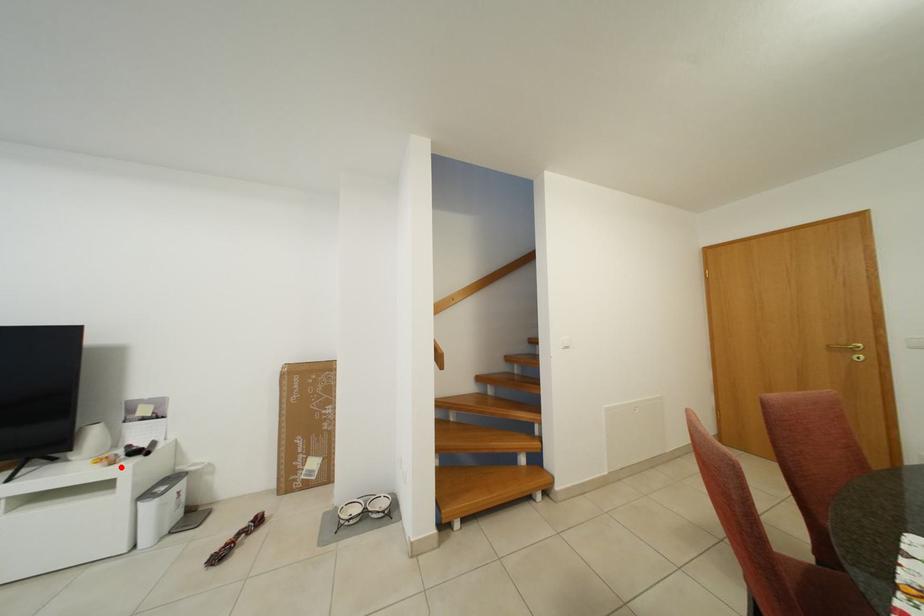
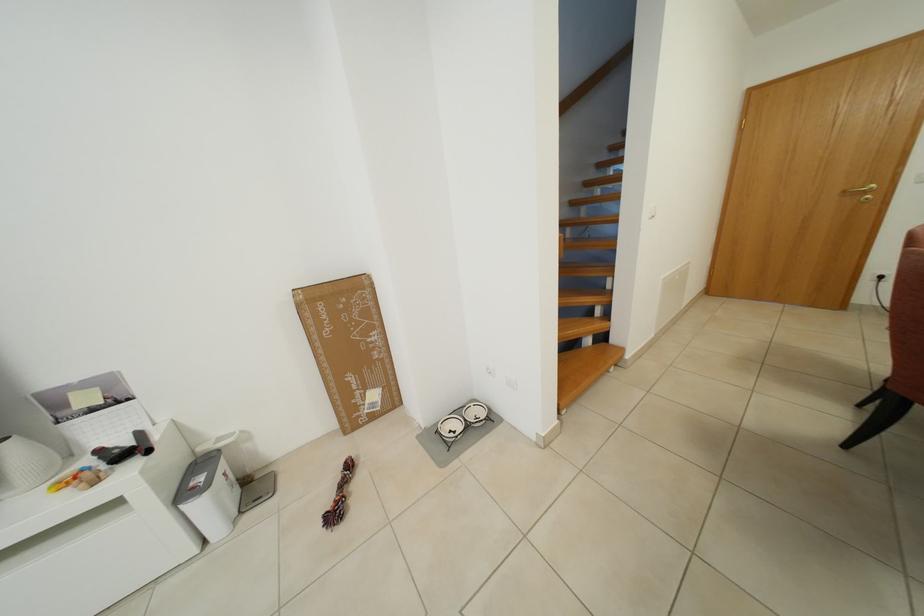
In the second image, find the point that corresponds to the highlighted location in the first image.

(103, 485)